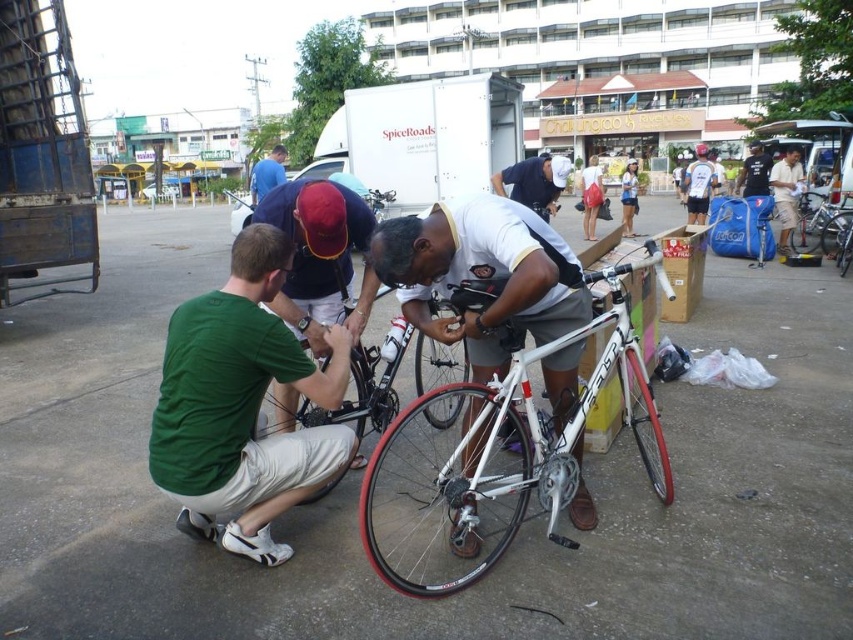
Is green fabric shirt at left to the right of blue fabric shirt at upper center from the viewer's perspective?

Correct, you'll find green fabric shirt at left to the right of blue fabric shirt at upper center.

Can you confirm if green fabric shirt at left is wider than blue fabric shirt at upper center?

No.

Between point (288, 314) and point (270, 177), which one is positioned in front?

Point (288, 314) is in front.

Where is `green fabric shirt at left`? green fabric shirt at left is located at coordinates (320, 257).

Is point (172, 397) closer to camera compared to point (631, 179)?

Yes, point (172, 397) is in front of point (631, 179).

At what (x,y) coordinates should I click in order to perform the action: click on green fabric shirt at lower left. Please return your answer as a coordinate pair (x, y). This screenshot has width=853, height=640. Looking at the image, I should click on (242, 404).

Is white matte shirt at center above white jersey at center?

Incorrect, white matte shirt at center is not positioned above white jersey at center.

Is point (517, 179) closer to camera compared to point (698, 154)?

Yes, point (517, 179) is in front of point (698, 154).

Find the location of a particular element. white matte shirt at center is located at coordinates (534, 182).